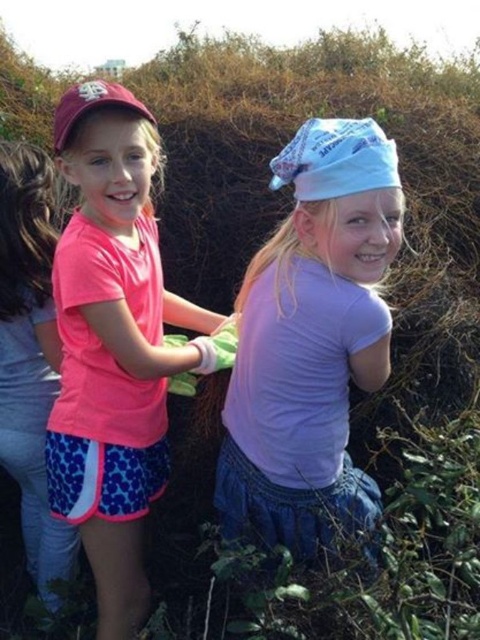
Question: Is light blue fabric bandana at center below pink matte shirt at left?

Choices:
 (A) yes
 (B) no

Answer: (B)

Question: Does light blue fabric bandana at center appear on the left side of pink matte shirt at left?

Choices:
 (A) yes
 (B) no

Answer: (B)

Question: Which point is closer to the camera?

Choices:
 (A) (142, 356)
 (B) (263, 273)

Answer: (A)

Question: Is light blue fabric bandana at center above pink matte shirt at left?

Choices:
 (A) no
 (B) yes

Answer: (B)

Question: Which object appears closest to the camera in this image?

Choices:
 (A) light blue fabric bandana at center
 (B) pink matte shirt at left

Answer: (A)